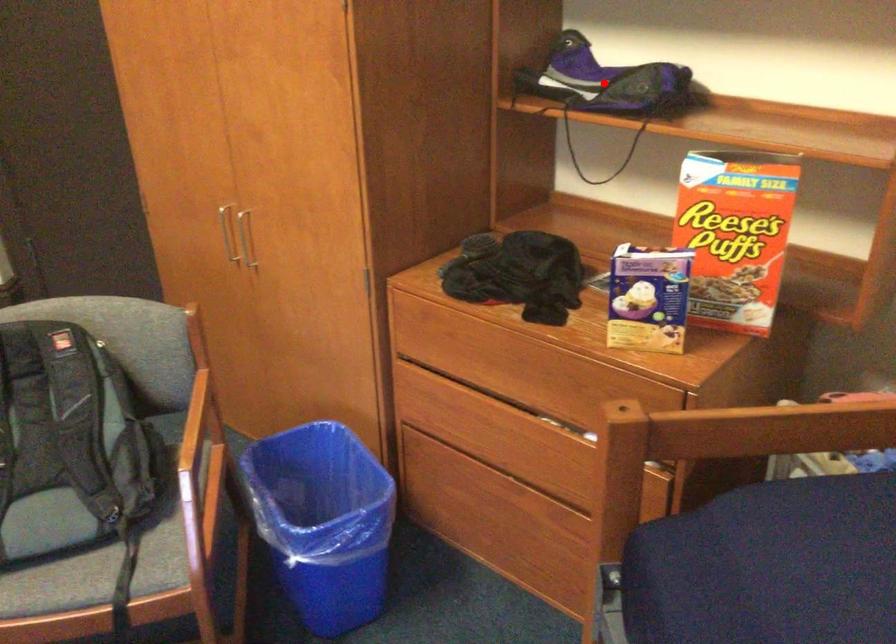
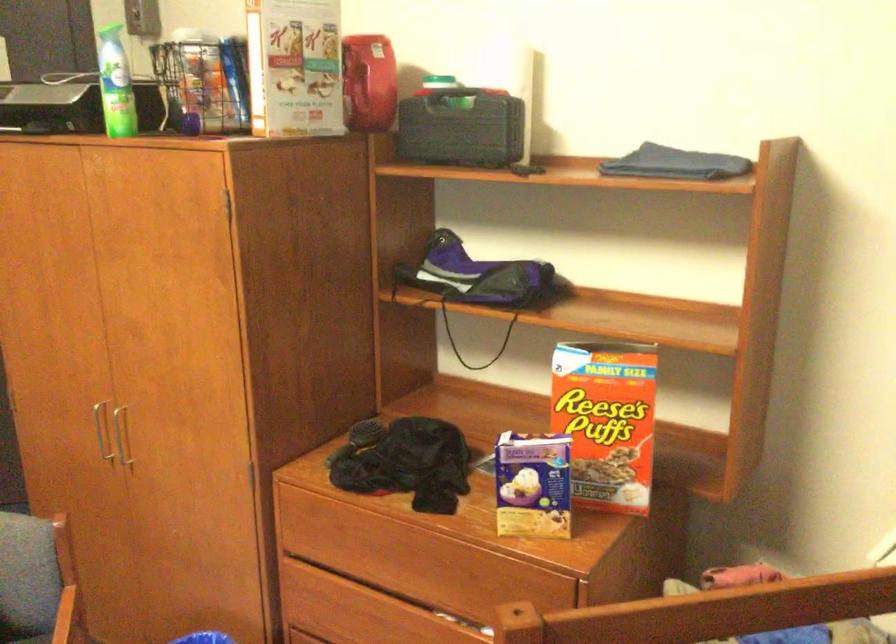
The point at the highlighted location is marked in the first image. Where is the corresponding point in the second image?

(476, 275)